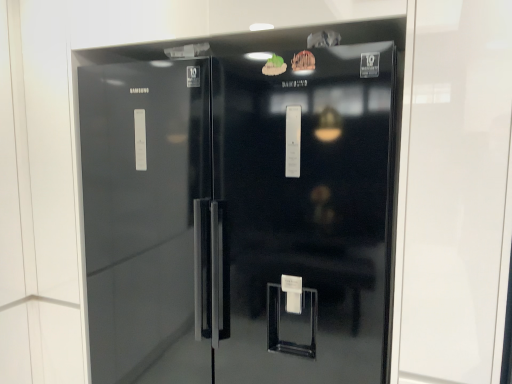
Question: Is glossy black refrigerator at center oriented towards green matte food at upper center, the second food from the right?

Choices:
 (A) yes
 (B) no

Answer: (A)

Question: Is glossy black refrigerator at center taller than green matte food at upper center, which appears as the first food when viewed from the left?

Choices:
 (A) no
 (B) yes

Answer: (B)

Question: Can you confirm if glossy black refrigerator at center is smaller than green matte food at upper center, which appears as the first food when viewed from the left?

Choices:
 (A) no
 (B) yes

Answer: (A)

Question: Is glossy black refrigerator at center to the right of green matte food at upper center, which appears as the first food when viewed from the left, from the viewer's perspective?

Choices:
 (A) no
 (B) yes

Answer: (A)

Question: Is green matte food at upper center, the second food from the right, inside glossy black refrigerator at center?

Choices:
 (A) no
 (B) yes

Answer: (B)

Question: Considering their positions, is glossy black refrigerator at center located in front of or behind wooden carving at upper center, acting as the first food starting from the right?

Choices:
 (A) behind
 (B) front

Answer: (B)

Question: In terms of height, does glossy black refrigerator at center look taller or shorter compared to wooden carving at upper center, acting as the first food starting from the right?

Choices:
 (A) short
 (B) tall

Answer: (B)

Question: Would you say glossy black refrigerator at center is inside or outside wooden carving at upper center, positioned as the 2th food in left-to-right order?

Choices:
 (A) inside
 (B) outside

Answer: (B)

Question: In terms of width, does glossy black refrigerator at center look wider or thinner when compared to wooden carving at upper center, positioned as the 2th food in left-to-right order?

Choices:
 (A) wide
 (B) thin

Answer: (A)

Question: Based on their positions, is green matte food at upper center, which appears as the first food when viewed from the left, located to the left or right of wooden carving at upper center, acting as the first food starting from the right?

Choices:
 (A) left
 (B) right

Answer: (A)

Question: Relative to wooden carving at upper center, positioned as the 2th food in left-to-right order, is green matte food at upper center, the second food from the right, in front or behind?

Choices:
 (A) front
 (B) behind

Answer: (B)

Question: Is green matte food at upper center, which appears as the first food when viewed from the left, taller or shorter than wooden carving at upper center, acting as the first food starting from the right?

Choices:
 (A) tall
 (B) short

Answer: (A)

Question: Do you think green matte food at upper center, which appears as the first food when viewed from the left, is within wooden carving at upper center, acting as the first food starting from the right, or outside of it?

Choices:
 (A) inside
 (B) outside

Answer: (B)

Question: Is wooden carving at upper center, acting as the first food starting from the right, inside the boundaries of glossy black refrigerator at center, or outside?

Choices:
 (A) outside
 (B) inside

Answer: (B)

Question: From their relative heights in the image, would you say wooden carving at upper center, acting as the first food starting from the right, is taller or shorter than glossy black refrigerator at center?

Choices:
 (A) tall
 (B) short

Answer: (B)